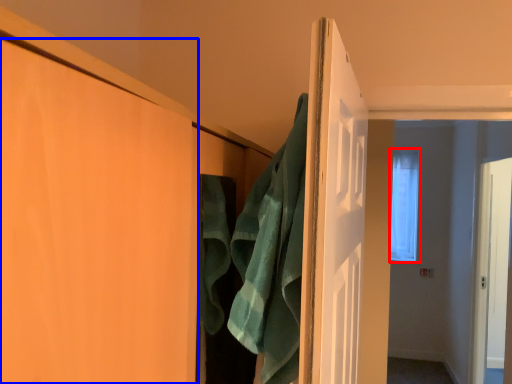
Question: Which of the following is the closest to the observer, window (highlighted by a red box) or door (highlighted by a blue box)?

Choices:
 (A) window
 (B) door

Answer: (B)